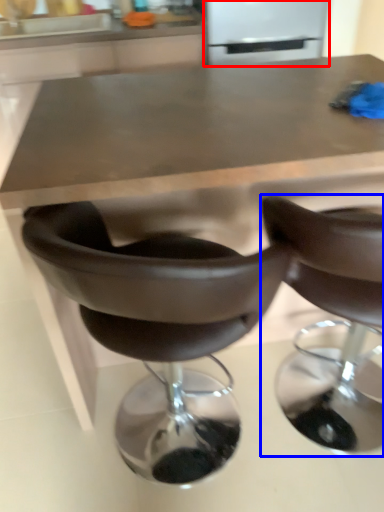
Question: Which object appears farthest to the camera in this image, appliance (highlighted by a red box) or chair (highlighted by a blue box)?

Choices:
 (A) appliance
 (B) chair

Answer: (A)